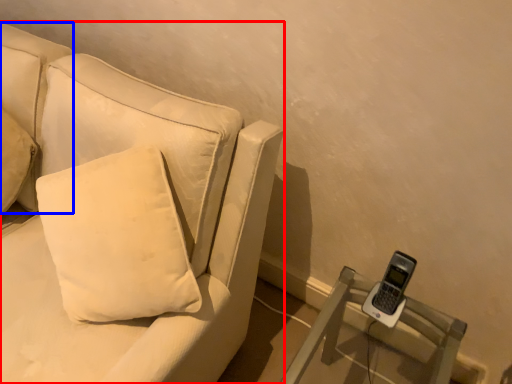
Question: Which object is closer to the camera taking this photo, studio couch (highlighted by a red box) or pillow (highlighted by a blue box)?

Choices:
 (A) studio couch
 (B) pillow

Answer: (A)